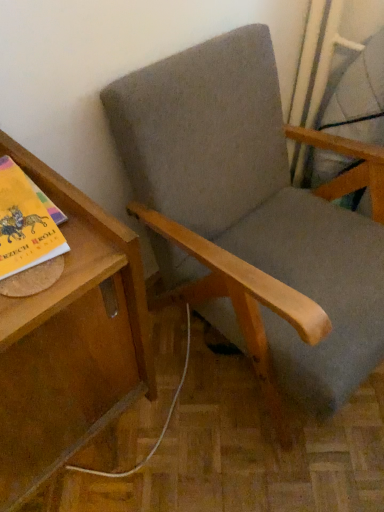
Measure the distance between point (x=374, y=88) and camera.

The distance of point (x=374, y=88) from camera is 1.22 meters.

What do you see at coordinates (359, 97) in the screenshot? I see `matte gray swivel chair at upper right` at bounding box center [359, 97].

Where is `textured gray fabric chair at center`? textured gray fabric chair at center is located at coordinates (250, 214).

What is the approximate width of textured gray fabric chair at center?

The width of textured gray fabric chair at center is 29.66 inches.

Image resolution: width=384 pixels, height=512 pixels. Describe the element at coordinates (70, 342) in the screenshot. I see `wooden table at left` at that location.

You are a GUI agent. You are given a task and a screenshot of the screen. Output one action in this format:
    pyautogui.click(x=<x>, y=<y>)
    Task: Click on the matte gray swivel chair at upper right
    
    Given the screenshot: What is the action you would take?
    pyautogui.click(x=359, y=97)

Which point is more forward, (8, 381) or (142, 158)?

The point (8, 381) is in front.

Is wooden table at left far away from textured gray fabric chair at center?

wooden table at left is actually quite close to textured gray fabric chair at center.

From the image's perspective, relative to textured gray fabric chair at center, is wooden table at left above or below?

Based on their image positions, wooden table at left is located beneath textured gray fabric chair at center.

Based on the photo, is matte gray swivel chair at upper right taller or shorter than wooden table at left?

Clearly, matte gray swivel chair at upper right is shorter compared to wooden table at left.

How distant is matte gray swivel chair at upper right from wooden table at left?

matte gray swivel chair at upper right is 35.89 inches away from wooden table at left.

Between matte gray swivel chair at upper right and wooden table at left, which one has smaller width?

matte gray swivel chair at upper right is thinner.

From a real-world perspective, who is located lower, matte gray swivel chair at upper right or wooden table at left?

In real-world perspective, wooden table at left is lower.

Does matte gray swivel chair at upper right have a greater width compared to textured gray fabric chair at center?

No.

Between matte gray swivel chair at upper right and textured gray fabric chair at center, which one appears on the right side from the viewer's perspective?

Positioned to the right is matte gray swivel chair at upper right.

Is textured gray fabric chair at center inside matte gray swivel chair at upper right?

Answer: No.

From a real-world perspective, is textured gray fabric chair at center physically above wooden table at left?

Yes, from a real-world perspective, textured gray fabric chair at center is above wooden table at left.

Would you say textured gray fabric chair at center is to the left or to the right of wooden table at left in the picture?

From the image, it's evident that textured gray fabric chair at center is to the right of wooden table at left.

Is textured gray fabric chair at center oriented away from wooden table at left?

No.

Looking at this image, is textured gray fabric chair at center closer to the viewer compared to wooden table at left?

No, textured gray fabric chair at center is further to the viewer.

From a real-world perspective, is textured gray fabric chair at center physically located above or below matte gray swivel chair at upper right?

Clearly, from a real-world perspective, textured gray fabric chair at center is below matte gray swivel chair at upper right.

Which object is wider, textured gray fabric chair at center or matte gray swivel chair at upper right?

textured gray fabric chair at center.

Considering the relative positions of textured gray fabric chair at center and matte gray swivel chair at upper right in the image provided, is textured gray fabric chair at center to the right of matte gray swivel chair at upper right from the viewer's perspective?

In fact, textured gray fabric chair at center is to the left of matte gray swivel chair at upper right.

Can matte gray swivel chair at upper right be found inside wooden table at left?

Definitely not — matte gray swivel chair at upper right is not inside wooden table at left.

Considering the positions of objects wooden table at left and matte gray swivel chair at upper right in the image provided, who is more to the left, wooden table at left or matte gray swivel chair at upper right?

wooden table at left.

Is wooden table at left facing towards matte gray swivel chair at upper right?

No, wooden table at left is not facing towards matte gray swivel chair at upper right.

Is wooden table at left taller than matte gray swivel chair at upper right?

Indeed, wooden table at left has a greater height compared to matte gray swivel chair at upper right.

Identify the location of chair that is above the wooden table at left (from the image's perspective). The height and width of the screenshot is (512, 384). (250, 214).

You are a GUI agent. You are given a task and a screenshot of the screen. Output one action in this format:
    pyautogui.click(x=<x>, y=<y>)
    Task: Click on the table below the matte gray swivel chair at upper right (from a real-world perspective)
    This screenshot has width=384, height=512.
    Given the screenshot: What is the action you would take?
    pyautogui.click(x=70, y=342)

When comparing their distances from matte gray swivel chair at upper right, does wooden table at left or textured gray fabric chair at center seem closer?

Based on the image, textured gray fabric chair at center appears to be nearer to matte gray swivel chair at upper right.

Based on their spatial positions, is matte gray swivel chair at upper right or wooden table at left closer to textured gray fabric chair at center?

matte gray swivel chair at upper right is closer to textured gray fabric chair at center.

Considering their positions, is textured gray fabric chair at center positioned closer to matte gray swivel chair at upper right than wooden table at left?

textured gray fabric chair at center.

Considering their positions, is textured gray fabric chair at center positioned closer to wooden table at left than matte gray swivel chair at upper right?

textured gray fabric chair at center is closer to wooden table at left.

Looking at this image, looking at the image, which one is located closer to textured gray fabric chair at center, wooden table at left or matte gray swivel chair at upper right?

The object closer to textured gray fabric chair at center is matte gray swivel chair at upper right.

Estimate the real-world distances between objects in this image. Which object is further from wooden table at left, matte gray swivel chair at upper right or textured gray fabric chair at center?

matte gray swivel chair at upper right is further to wooden table at left.

In order to click on chair between wooden table at left and matte gray swivel chair at upper right from left to right in this screenshot , I will do `click(250, 214)`.